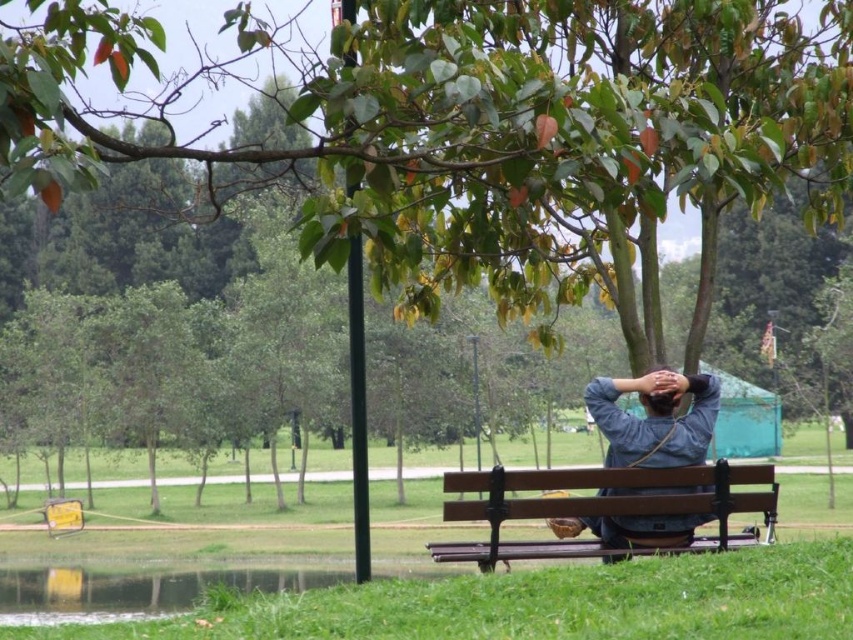
You are a photographer trying to capture the brown wooden bench at center and the brown matte head at center in a single shot. Since you want both objects to be clearly visible, which one should you focus on first to ensure proper depth of field?

The brown wooden bench at center is closer to the viewer than the brown matte head at center, so you should focus on the brown wooden bench at center first to ensure both are in focus.

You are a photographer planning to take a portrait of the person wearing the denim shirt at center. You want to ensure the brown wooden bench at center is visible in the background but not too prominent. Based on their sizes, what adjustment should you make to your camera settings or positioning?

The brown wooden bench at center is bigger than the denim shirt at center. To make the bench less prominent while still visible, you can position yourself farther away from the bench and zoom in on the denim shirt at center. This reduces the bench size in the frame while keeping it in the background.